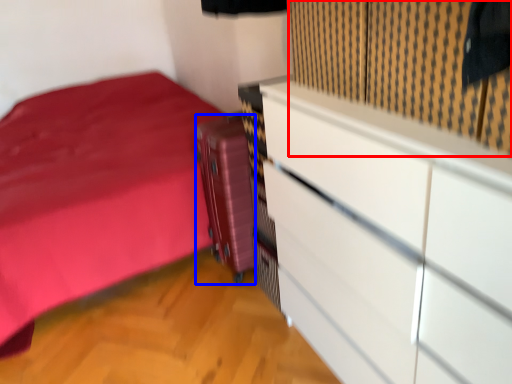
Question: Which object appears farthest to the camera in this image, curtain (highlighted by a red box) or luggage (highlighted by a blue box)?

Choices:
 (A) curtain
 (B) luggage

Answer: (B)